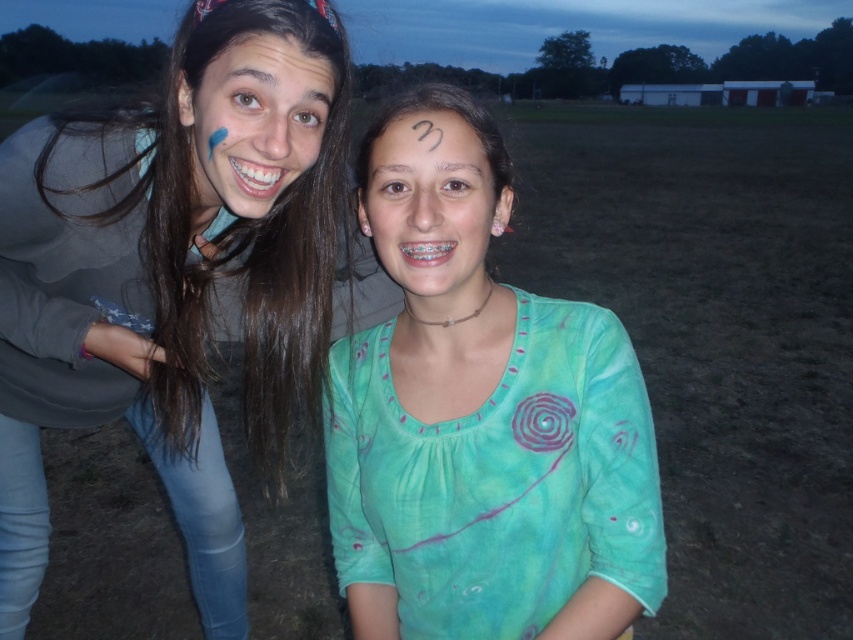
Question: Which object is positioned farthest from the matte green shirt at center?

Choices:
 (A) teal tie-dye shirt at center
 (B) smooth skin forehead at center
 (C) matte gray sweatshirt at left

Answer: (C)

Question: Which object is the farthest from the matte gray sweatshirt at left?

Choices:
 (A) matte green shirt at center
 (B) matte blue paint at left
 (C) smooth skin forehead at center
 (D) teal tie-dye shirt at center

Answer: (C)

Question: Does teal tie-dye shirt at center appear under matte blue paint at left?

Choices:
 (A) yes
 (B) no

Answer: (A)

Question: Can you confirm if matte green shirt at center is positioned to the right of smooth skin forehead at center?

Choices:
 (A) no
 (B) yes

Answer: (B)

Question: Considering the relative positions of teal tie-dye shirt at center and smooth skin forehead at center in the image provided, where is teal tie-dye shirt at center located with respect to smooth skin forehead at center?

Choices:
 (A) above
 (B) below

Answer: (B)

Question: Among these objects, which one is nearest to the camera?

Choices:
 (A) smooth skin forehead at center
 (B) matte blue paint at left
 (C) teal tie-dye shirt at center
 (D) matte gray sweatshirt at left

Answer: (C)